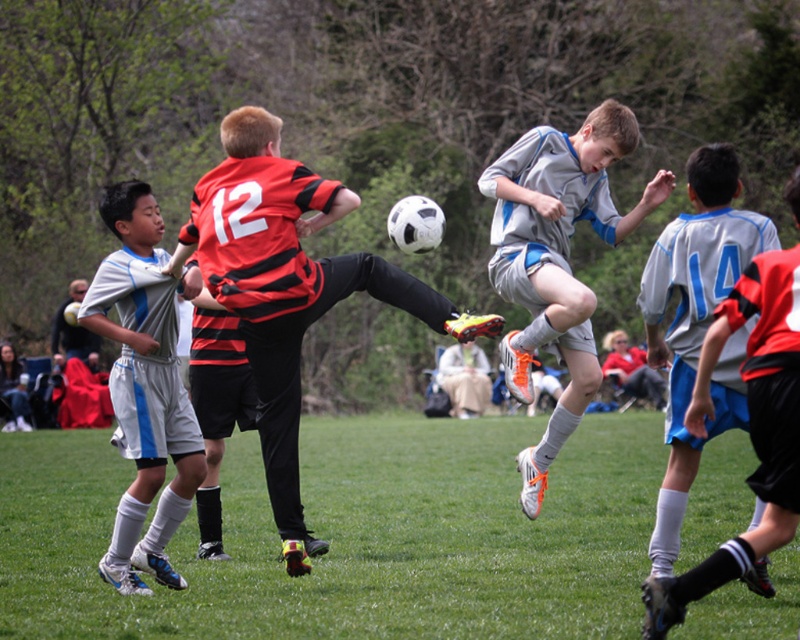
You are a referee observing the soccer match. You notice the red and black striped jersey at center and the white matte soccer uniform at left. Which player is wearing a larger uniform?

The red and black striped jersey at center is larger in size than the white matte soccer uniform at left, so the player wearing the red and black striped jersey at center has the larger uniform.

You are a soccer coach analyzing the positions of two key points on the field. The first point is at coordinates point (336, 259) and the second is at point (141, 276). Based on the image, which point is closer to the camera?

Point (336, 259) is closer to the viewer than point (141, 276).

You are a photographer standing at the edge of the soccer field. You want to take a photo that includes both the green grass at center and the matte gray jacket at left. Which object will appear larger in your photo?

The green grass at center will appear larger in the photo because it is closer to the viewer than the matte gray jacket at left.